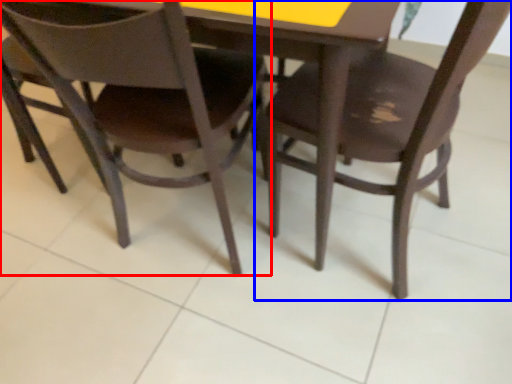
Question: Which object is closer to the camera taking this photo, chair (highlighted by a red box) or chair (highlighted by a blue box)?

Choices:
 (A) chair
 (B) chair

Answer: (B)